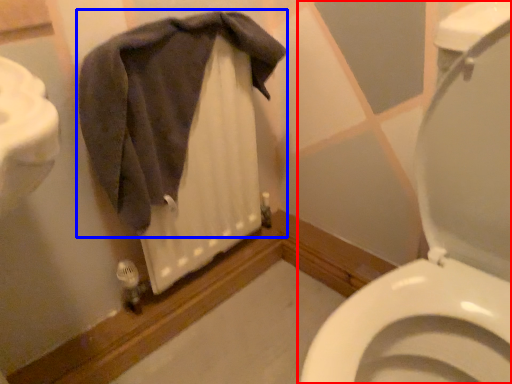
Question: Which object is further to the camera taking this photo, toilet (highlighted by a red box) or bath towel (highlighted by a blue box)?

Choices:
 (A) toilet
 (B) bath towel

Answer: (B)